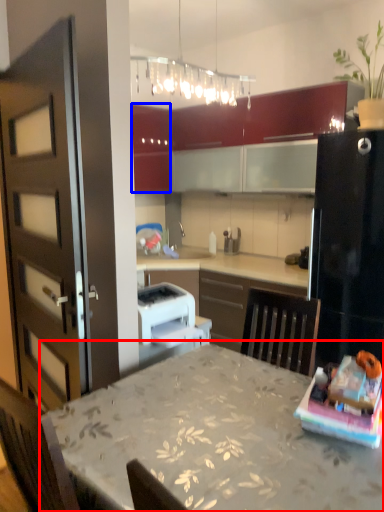
Question: Which object is further to the camera taking this photo, table (highlighted by a red box) or cabinetry (highlighted by a blue box)?

Choices:
 (A) table
 (B) cabinetry

Answer: (B)